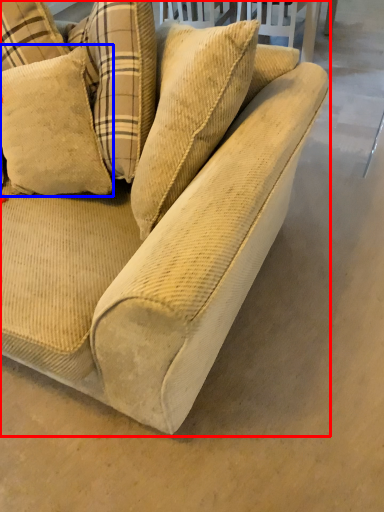
Question: Which point is further to the camera, studio couch (highlighted by a red box) or pillow (highlighted by a blue box)?

Choices:
 (A) studio couch
 (B) pillow

Answer: (B)